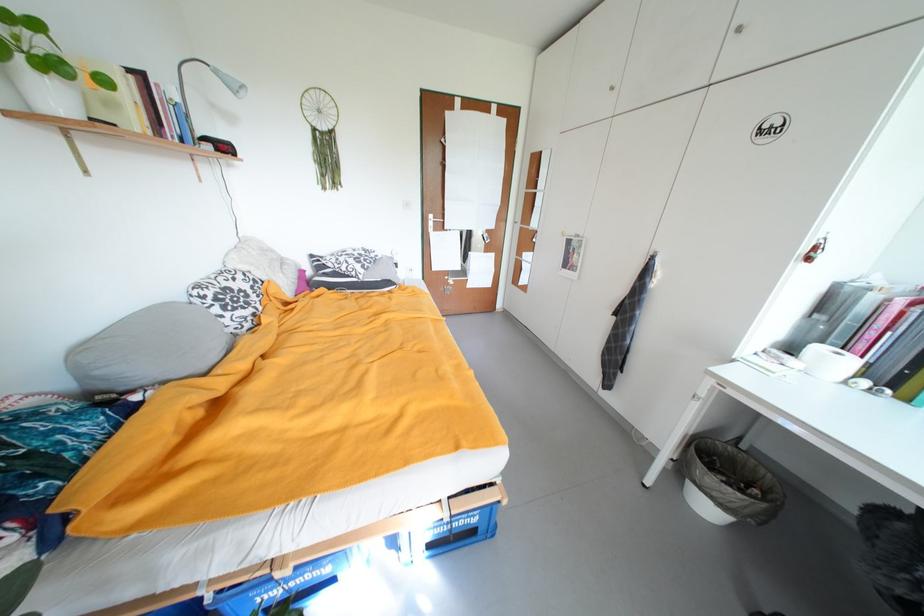
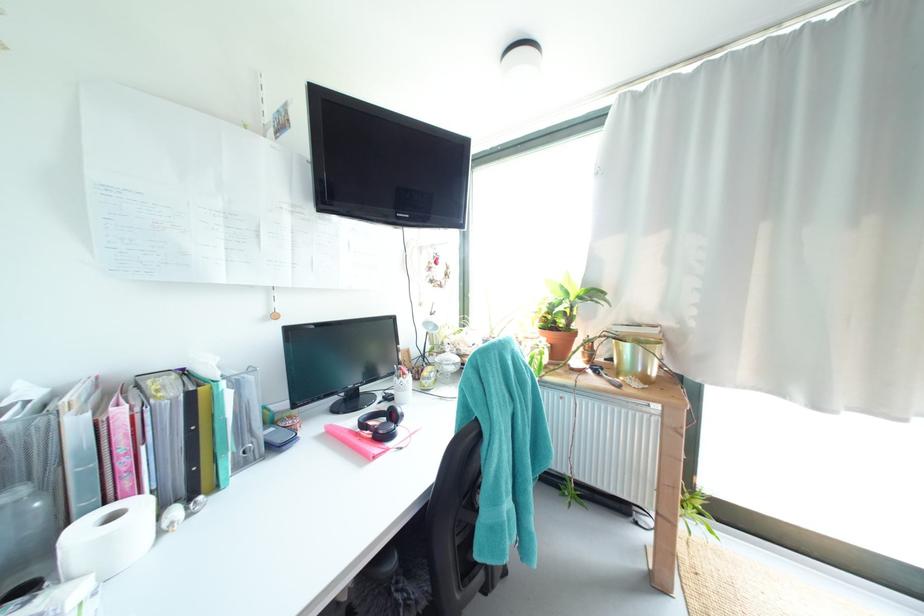
Find the pixel in the second image that matches the point at 845,355 in the first image.

(120, 517)